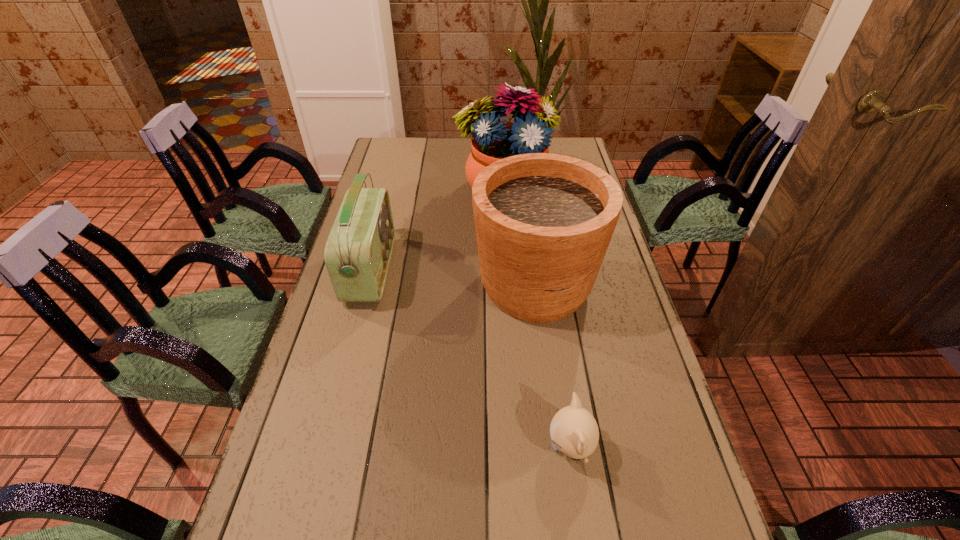
Where is `vacant space situated 0.310m on the face of the nearest object`? vacant space situated 0.310m on the face of the nearest object is located at coordinates (400, 447).

The width and height of the screenshot is (960, 540). I want to click on free location located on the face of the nearest object, so click(x=476, y=447).

Identify the location of vacant region located 0.260m on the face of the nearest object. (424, 447).

Identify the location of object positioned at the left edge. (358, 250).

You are a GUI agent. You are given a task and a screenshot of the screen. Output one action in this format:
    pyautogui.click(x=<x>, y=<y>)
    Task: Click on the flower arrangement that is positioned at the right edge
    The width and height of the screenshot is (960, 540).
    Given the screenshot: What is the action you would take?
    pyautogui.click(x=492, y=140)

Identify the location of flowerpot situated at the right edge. The width and height of the screenshot is (960, 540). (543, 222).

Image resolution: width=960 pixels, height=540 pixels. In order to click on free space at the far edge of the desktop in this screenshot , I will do click(429, 144).

At what (x,y) coordinates should I click in order to perform the action: click on free space at the left edge of the desktop. Please return your answer as a coordinate pair (x, y). Looking at the image, I should click on (305, 415).

Find the location of `free space at the right edge of the desktop`. free space at the right edge of the desktop is located at coordinates (635, 356).

The image size is (960, 540). In order to click on free space at the far right corner of the desktop in this screenshot , I will do `click(555, 147)`.